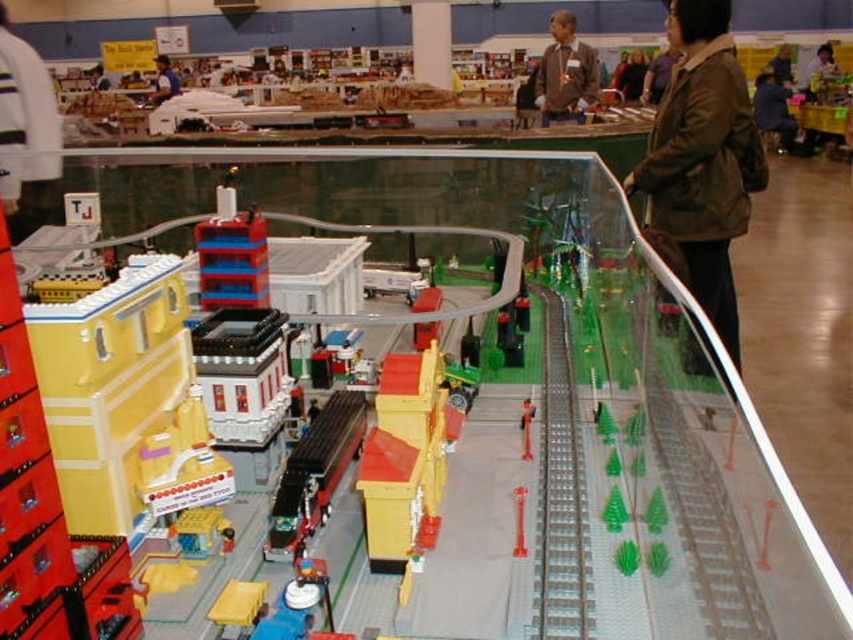
Question: Does yellow matte train car at center appear under silver metallic train track at center?

Choices:
 (A) yes
 (B) no

Answer: (A)

Question: Estimate the real-world distances between objects in this image. Which object is farther from the brown matte jacket at upper right?

Choices:
 (A) metallic red train at center
 (B) white fabric jacket at upper center
 (C) matte gray sweater at upper center
 (D) yellow matte train car at center

Answer: (C)

Question: Which is nearer to the brown matte jacket at upper right?

Choices:
 (A) yellow matte train car at center
 (B) white fabric jacket at upper center
 (C) translucent plastic train at center

Answer: (A)

Question: Which of these objects is positioned farthest from the silver metallic train track at center?

Choices:
 (A) translucent plastic train at center
 (B) metallic red train at center

Answer: (B)

Question: Is matte gray sweater at upper center above blue shirt at upper left?

Choices:
 (A) no
 (B) yes

Answer: (A)

Question: Can you confirm if matte gray sweater at upper center is thinner than brown leather jacket at upper right?

Choices:
 (A) yes
 (B) no

Answer: (A)